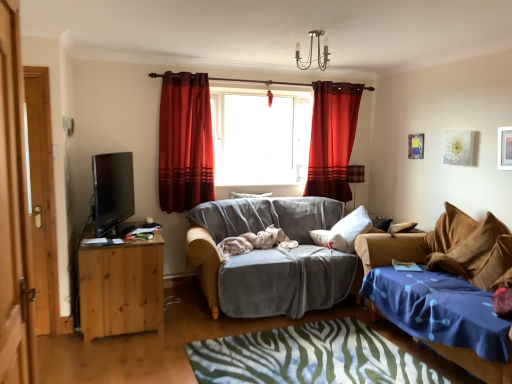
What are the coordinates of `free space in front of wooden door at left, placed as the 1th door when sorted from left to right` in the screenshot? It's located at (44, 342).